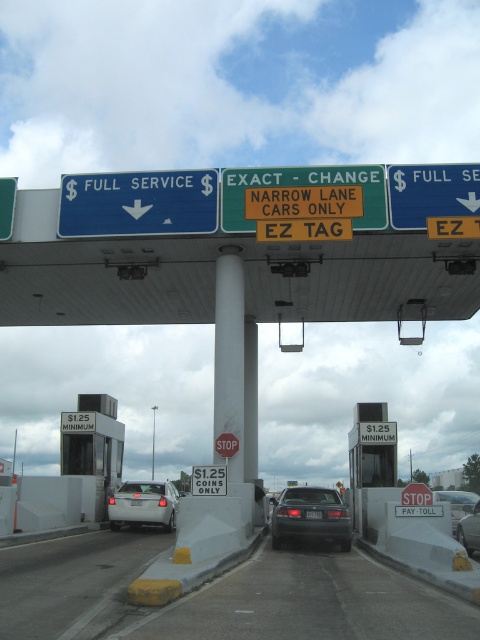
Can you confirm if white rectangular sign at center is shorter than stop sign at center?

Yes, white rectangular sign at center is shorter than stop sign at center.

Can you confirm if white rectangular sign at center is bigger than stop sign at center?

No, white rectangular sign at center is not bigger than stop sign at center.

This screenshot has height=640, width=480. Describe the element at coordinates (377, 433) in the screenshot. I see `white rectangular sign at center` at that location.

You are a GUI agent. You are given a task and a screenshot of the screen. Output one action in this format:
    pyautogui.click(x=<x>, y=<y>)
    Task: Click on the white rectangular sign at center
    
    Given the screenshot: What is the action you would take?
    pyautogui.click(x=377, y=433)

Can you confirm if yellow rubber curb at lower center is smaller than white matte sedan at center?

No, yellow rubber curb at lower center is not smaller than white matte sedan at center.

Is point (9, 564) positioned after point (145, 506)?

No, it is not.

Locate an element on the screen. yellow rubber curb at lower center is located at coordinates (72, 582).

Locate an element on the screen. This screenshot has height=640, width=480. dark gray matte sedan at center is located at coordinates (310, 518).

The height and width of the screenshot is (640, 480). What do you see at coordinates (310, 518) in the screenshot?
I see `dark gray matte sedan at center` at bounding box center [310, 518].

Which is in front, point (326, 518) or point (200, 490)?

Positioned in front is point (326, 518).

This screenshot has width=480, height=640. In order to click on dark gray matte sedan at center in this screenshot , I will do `click(310, 518)`.